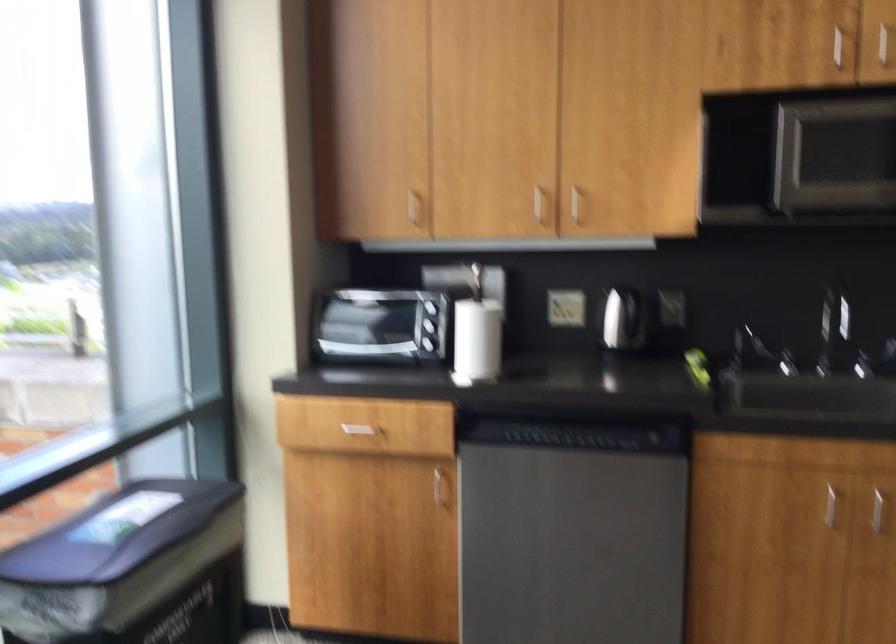
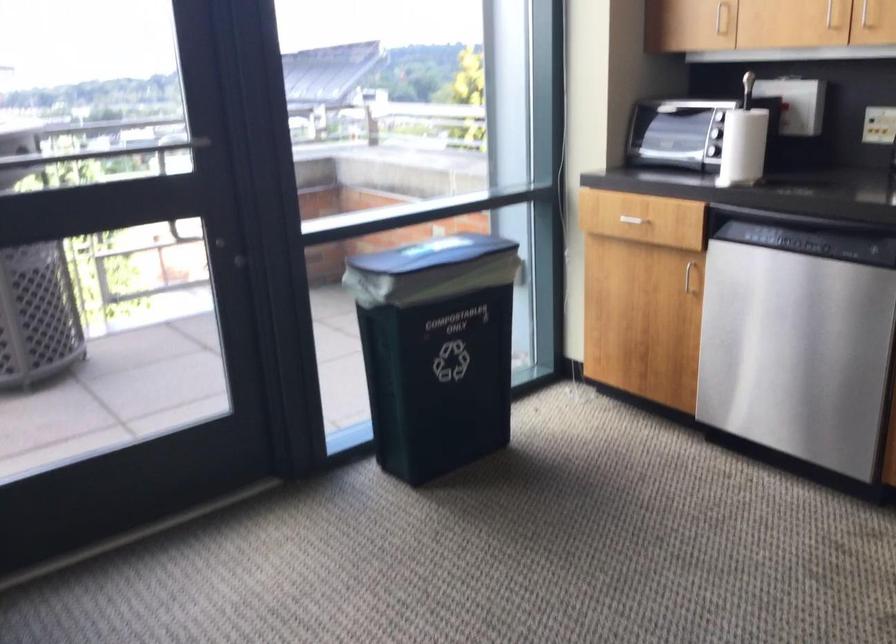
Where in the second image is the point corresponding to [358,426] from the first image?

(633, 214)